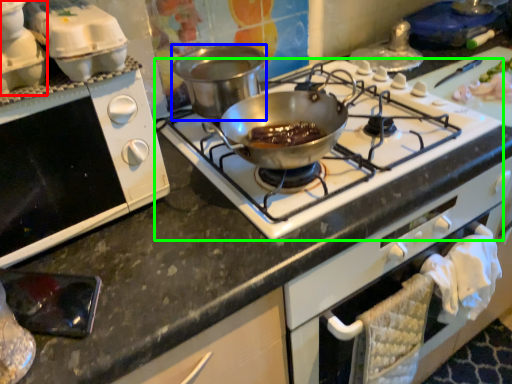
Question: Which object is positioned farthest from kitchen appliance (highlighted by a red box)? Select from pot/pan (highlighted by a blue box) and gas stove (highlighted by a green box).

Choices:
 (A) pot/pan
 (B) gas stove

Answer: (B)